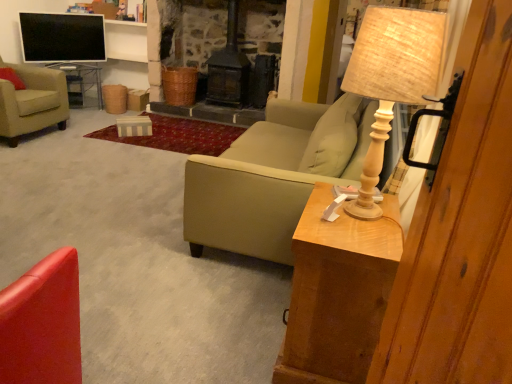
The image size is (512, 384). In order to click on free location to the right of beige fabric armchair at left, placed as the first chair when sorted from left to right in this screenshot , I will do `click(75, 134)`.